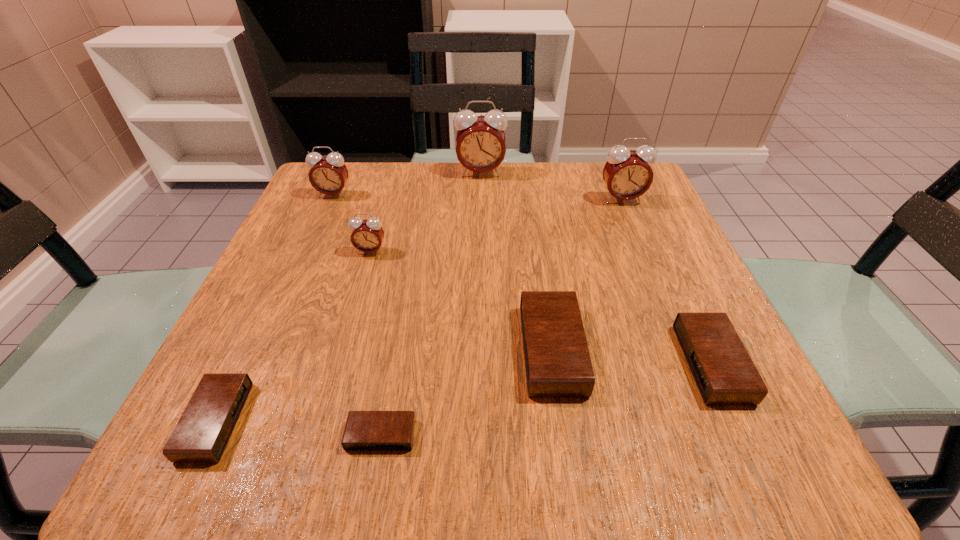
I want to click on the rightmost black alarm clock, so click(725, 374).

At what (x,y) coordinates should I click in order to perform the action: click on the third smallest black alarm clock. Please return your answer as a coordinate pair (x, y). Image resolution: width=960 pixels, height=540 pixels. Looking at the image, I should click on (725, 374).

In order to click on the second shortest alarm clock in this screenshot , I will do `click(202, 433)`.

At what (x,y) coordinates should I click in order to perform the action: click on the second shortest object. Please return your answer as a coordinate pair (x, y). Looking at the image, I should click on (202, 433).

Locate an element on the screen. The height and width of the screenshot is (540, 960). the second black alarm clock from left to right is located at coordinates (365, 430).

Where is `the fourth alarm clock from left to right`? This screenshot has height=540, width=960. the fourth alarm clock from left to right is located at coordinates (365, 430).

This screenshot has height=540, width=960. Find the location of `vacant space located 0.390m on the clock face of the fourth alarm clock from right to left`. vacant space located 0.390m on the clock face of the fourth alarm clock from right to left is located at coordinates (481, 291).

Locate an element on the screen. The height and width of the screenshot is (540, 960). vacant space located 0.140m on the clock face of the rightmost pink alarm clock is located at coordinates pos(640,245).

This screenshot has height=540, width=960. I want to click on free spot located on the clock face of the sixth shortest object, so click(x=317, y=231).

At what (x,y) coordinates should I click in order to perform the action: click on vacant space located 0.230m on the clock face of the sixth alarm clock from right to left. Please return your answer as a coordinate pair (x, y). Looking at the image, I should click on (343, 350).